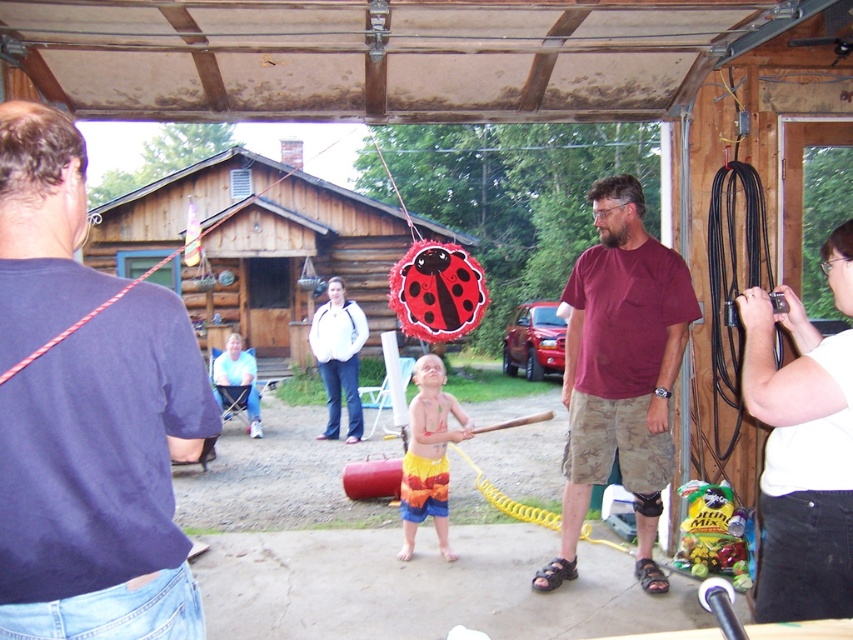
What object is located at the coordinates point (102, 477)?

The dark blue t shirt at upper left is located at point (102, 477).